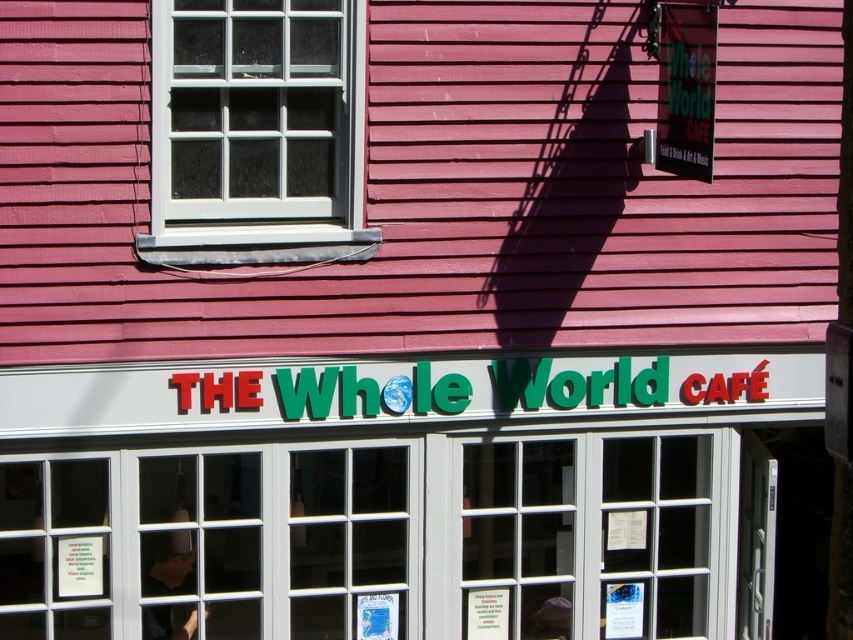
Question: Is white glass window at upper left positioned behind green plastic sign at upper right?

Choices:
 (A) yes
 (B) no

Answer: (A)

Question: Can you confirm if white glass window at upper left is positioned to the left of green plastic sign at upper right?

Choices:
 (A) yes
 (B) no

Answer: (A)

Question: Considering the relative positions of white glass window at upper left and green plastic sign at upper right in the image provided, where is white glass window at upper left located with respect to green plastic sign at upper right?

Choices:
 (A) below
 (B) above

Answer: (A)

Question: Which of the following is the closest to the observer?

Choices:
 (A) (264, 29)
 (B) (699, 36)

Answer: (B)

Question: Among these points, which one is nearest to the camera?

Choices:
 (A) (646, 141)
 (B) (258, 42)

Answer: (B)

Question: Which point is closer to the camera?

Choices:
 (A) (709, 13)
 (B) (250, 1)

Answer: (A)